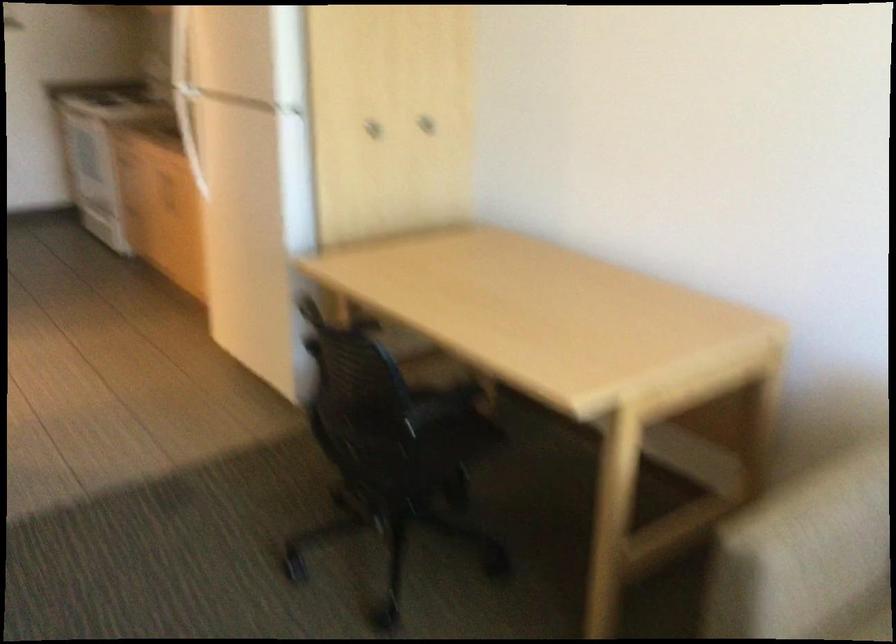
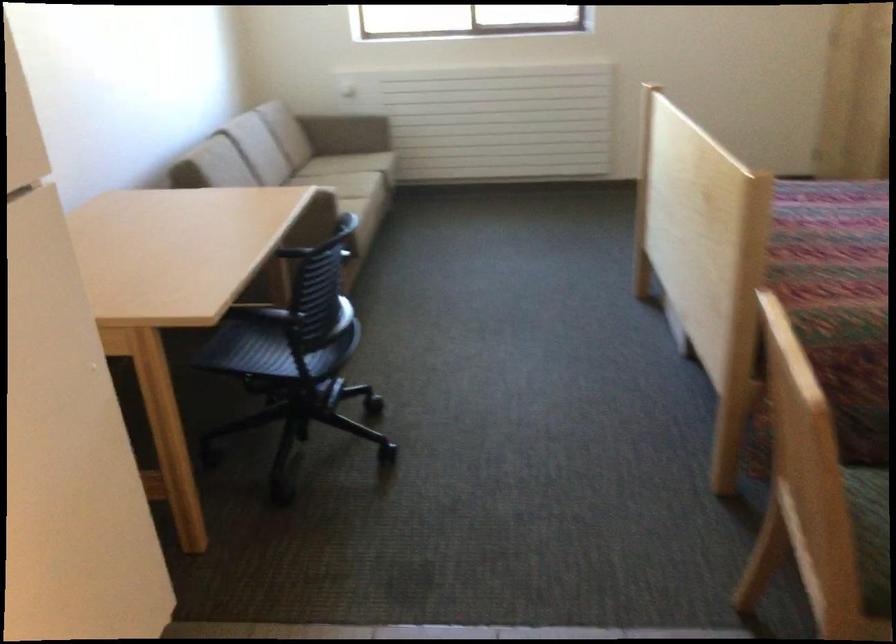
Where in the second image is the point corresponding to (x=731, y=562) from the first image?

(328, 198)